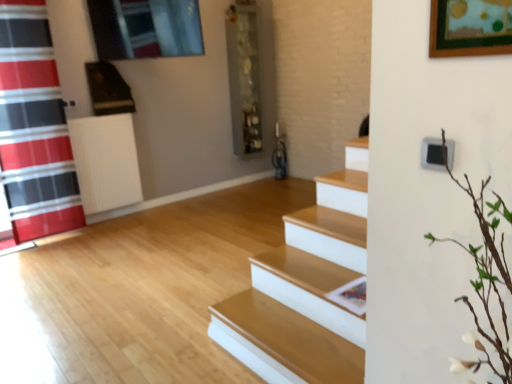
Question: Is metallic gray shelf at center shorter than red plaid shower curtain at left?

Choices:
 (A) no
 (B) yes

Answer: (B)

Question: Is metallic gray shelf at center positioned beyond the bounds of red plaid shower curtain at left?

Choices:
 (A) no
 (B) yes

Answer: (B)

Question: Is metallic gray shelf at center touching red plaid shower curtain at left?

Choices:
 (A) no
 (B) yes

Answer: (A)

Question: Is metallic gray shelf at center further to camera compared to red plaid shower curtain at left?

Choices:
 (A) yes
 (B) no

Answer: (A)

Question: From a real-world perspective, is metallic gray shelf at center under red plaid shower curtain at left?

Choices:
 (A) no
 (B) yes

Answer: (A)

Question: Does metallic gray shelf at center have a greater width compared to red plaid shower curtain at left?

Choices:
 (A) no
 (B) yes

Answer: (B)

Question: Is white plastic radiator at left wider than red plaid shower curtain at left?

Choices:
 (A) no
 (B) yes

Answer: (B)

Question: From the image's perspective, is white plastic radiator at left over red plaid shower curtain at left?

Choices:
 (A) yes
 (B) no

Answer: (B)

Question: Does white plastic radiator at left have a smaller size compared to red plaid shower curtain at left?

Choices:
 (A) no
 (B) yes

Answer: (B)

Question: Is white plastic radiator at left aimed at red plaid shower curtain at left?

Choices:
 (A) no
 (B) yes

Answer: (A)

Question: Is white plastic radiator at left outside of red plaid shower curtain at left?

Choices:
 (A) no
 (B) yes

Answer: (B)

Question: Is white plastic radiator at left to the left of red plaid shower curtain at left from the viewer's perspective?

Choices:
 (A) no
 (B) yes

Answer: (A)

Question: Is red plaid shower curtain at left taller than white plastic radiator at left?

Choices:
 (A) no
 (B) yes

Answer: (B)